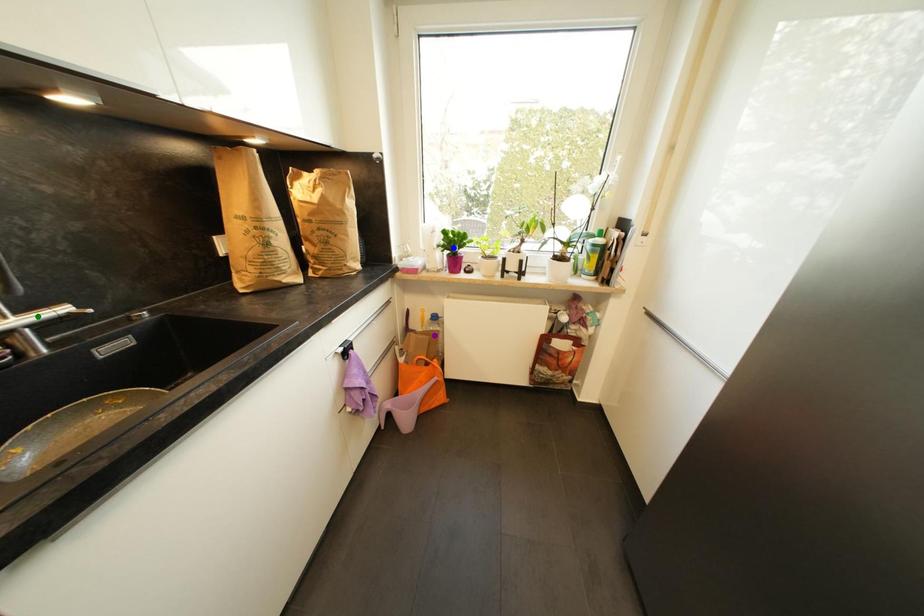
Order these from farthest to nearest:
purple point | blue point | green point

1. purple point
2. blue point
3. green point